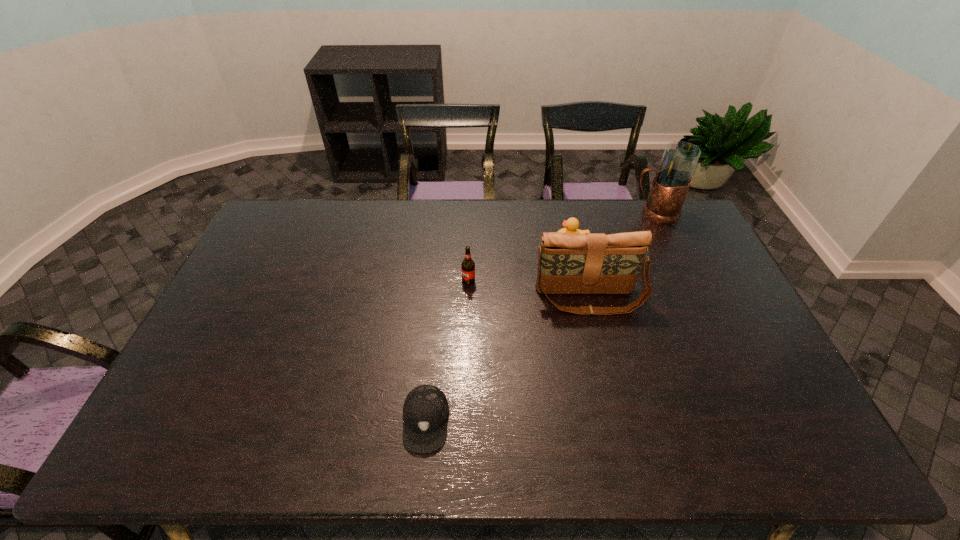
Where is `object at the right edge`? Image resolution: width=960 pixels, height=540 pixels. object at the right edge is located at coordinates (671, 183).

You are a GUI agent. You are given a task and a screenshot of the screen. Output one action in this format:
    pyautogui.click(x=<x>, y=<y>)
    Task: Click on the object that is at the far right corner
    This screenshot has width=960, height=540.
    Given the screenshot: What is the action you would take?
    pyautogui.click(x=671, y=183)

Locate an element on the screen. The width and height of the screenshot is (960, 540). vacant area at the far edge of the desktop is located at coordinates click(336, 222).

You are a GUI agent. You are given a task and a screenshot of the screen. Output one action in this format:
    pyautogui.click(x=<x>, y=<y>)
    Task: Click on the free space at the left edge of the desktop
    Image resolution: width=960 pixels, height=540 pixels.
    Given the screenshot: What is the action you would take?
    pyautogui.click(x=236, y=380)

Locate an element on the screen. This screenshot has height=540, width=960. blank space at the right edge of the desktop is located at coordinates (757, 345).

Where is `free space at the far left corner of the desktop`? The height and width of the screenshot is (540, 960). free space at the far left corner of the desktop is located at coordinates (276, 206).

In order to click on free space between the cap and the pitcher in this screenshot , I will do `click(540, 316)`.

I want to click on vacant area between the second object from left to right and the shoulder bag, so click(x=528, y=289).

The image size is (960, 540). I want to click on vacant space that is in between the second object from left to right and the shoulder bag, so click(528, 289).

The width and height of the screenshot is (960, 540). In order to click on free spot between the pitcher and the shortest object in this screenshot , I will do `click(540, 316)`.